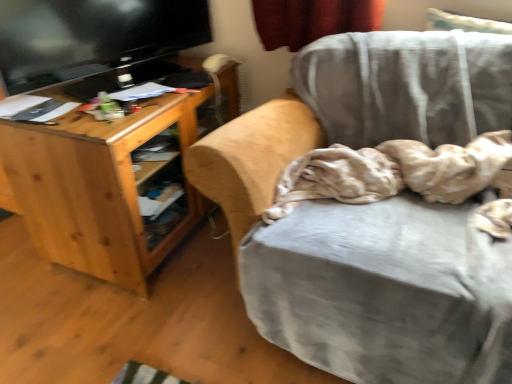
Question: In the image, is velvet gray chair at center positioned in front of or behind beige soft fabric at center?

Choices:
 (A) front
 (B) behind

Answer: (A)

Question: In terms of height, does velvet gray chair at center look taller or shorter compared to beige soft fabric at center?

Choices:
 (A) tall
 (B) short

Answer: (A)

Question: Estimate the real-world distances between objects in this image. Which object is closer to the natural wood desk at left?

Choices:
 (A) velvet gray chair at center
 (B) beige soft fabric at center
 (C) black glossy television at upper left

Answer: (C)

Question: Estimate the real-world distances between objects in this image. Which object is closer to the natural wood desk at left?

Choices:
 (A) black glossy television at upper left
 (B) beige soft fabric at center
 (C) velvet gray chair at center

Answer: (A)